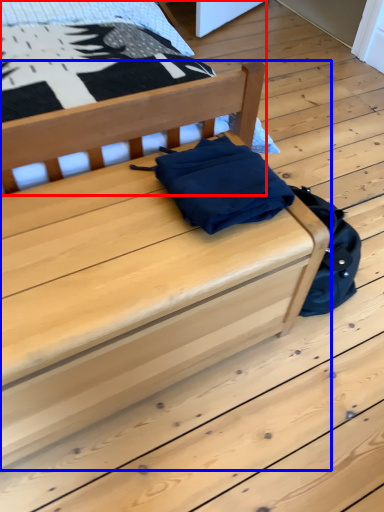
Question: Which point is closer to the camera, furniture (highlighted by a red box) or furniture (highlighted by a blue box)?

Choices:
 (A) furniture
 (B) furniture

Answer: (B)